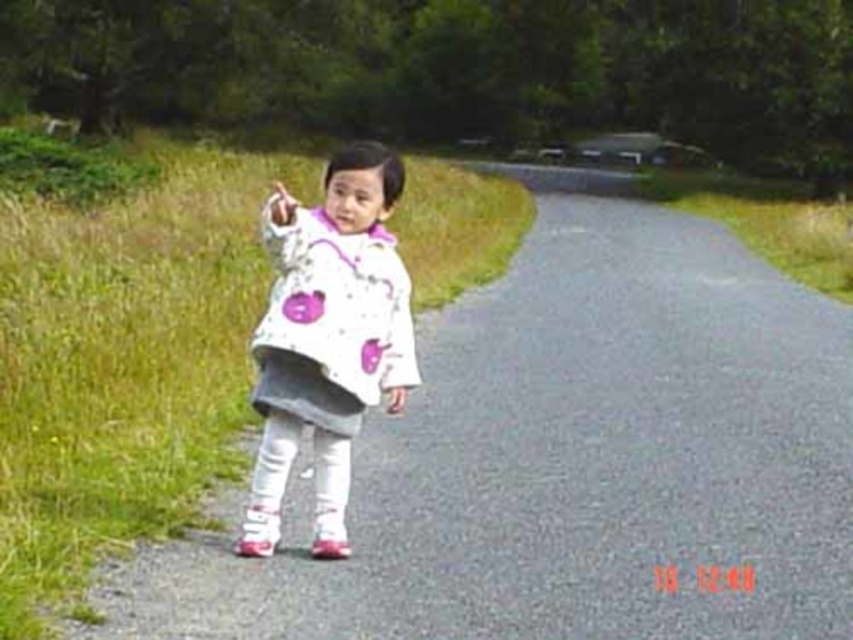
Is asphalt road at center smaller than white matte hand at center?

No.

Is point (689, 412) positioned after point (277, 192)?

No, it is in front of (277, 192).

The width and height of the screenshot is (853, 640). I want to click on asphalt road at center, so click(x=569, y=458).

Based on the photo, is white matte jacket at center wider than white matte hand at center?

In fact, white matte jacket at center might be narrower than white matte hand at center.

Can you confirm if white matte jacket at center is positioned to the left of white matte hand at center?

No, white matte jacket at center is not to the left of white matte hand at center.

Which is in front, point (378, 296) or point (280, 188)?

Positioned in front is point (378, 296).

At what (x,y) coordinates should I click in order to perform the action: click on white matte jacket at center. Please return your answer as a coordinate pair (x, y). This screenshot has height=640, width=853. Looking at the image, I should click on (329, 340).

Does asphalt road at center lie behind white matte jacket at center?

No, asphalt road at center is in front of white matte jacket at center.

Is point (654, 298) positioned behind point (340, 221)?

Yes.

The width and height of the screenshot is (853, 640). I want to click on asphalt road at center, so click(x=569, y=458).

At what (x,y) coordinates should I click in order to perform the action: click on asphalt road at center. Please return your answer as a coordinate pair (x, y). Image resolution: width=853 pixels, height=640 pixels. Looking at the image, I should click on [x=569, y=458].